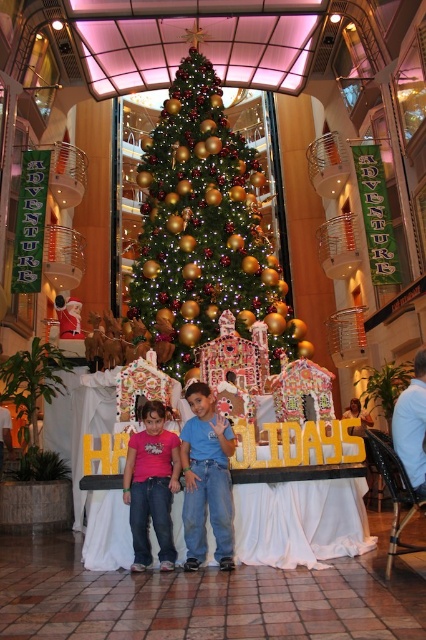
Question: Is green matte christmas tree at center further to the viewer compared to matte pink shirt at center?

Choices:
 (A) no
 (B) yes

Answer: (B)

Question: Among these objects, which one is farthest from the camera?

Choices:
 (A) green matte christmas tree at center
 (B) blue cotton shirt at center

Answer: (A)

Question: Can you confirm if green matte christmas tree at center is positioned above matte pink shirt at center?

Choices:
 (A) yes
 (B) no

Answer: (A)

Question: Which of these objects is positioned farthest from the matte pink shirt at center?

Choices:
 (A) blue cotton shirt at center
 (B) green matte christmas tree at center

Answer: (B)

Question: Which of the following is the closest to the observer?

Choices:
 (A) (244, 243)
 (B) (166, 536)
 (C) (207, 470)

Answer: (B)

Question: Can you confirm if green matte christmas tree at center is bigger than blue cotton shirt at center?

Choices:
 (A) yes
 (B) no

Answer: (A)